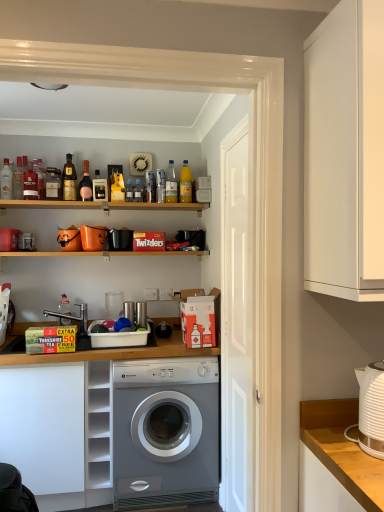
Locate an element on the screen. space that is in front of pink glass bottle at upper center, the fifth bottle in the left-to-right sequence is located at coordinates click(87, 201).